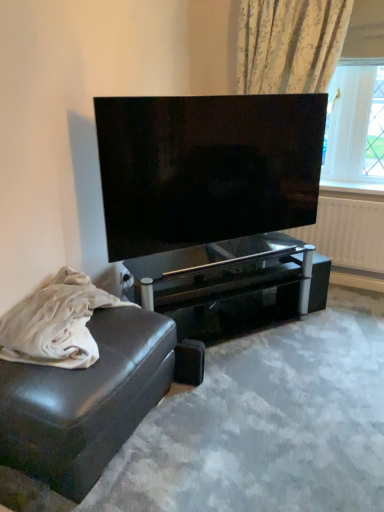
Question: Looking at their shapes, would you say leather couch at lower left is wider or thinner than matte black tv at center?

Choices:
 (A) thin
 (B) wide

Answer: (B)

Question: From their relative heights in the image, would you say leather couch at lower left is taller or shorter than matte black tv at center?

Choices:
 (A) short
 (B) tall

Answer: (A)

Question: Which of these objects is positioned closest to the leather couch at lower left?

Choices:
 (A) white glossy radiator at upper right
 (B) matte black tv at center
 (C) leather couch at lower left
 (D) black glass table at center

Answer: (C)

Question: Based on their relative distances, which object is nearer to the black glass table at center?

Choices:
 (A) leather couch at lower left
 (B) leather couch at lower left
 (C) matte black tv at center
 (D) white glossy radiator at upper right

Answer: (C)